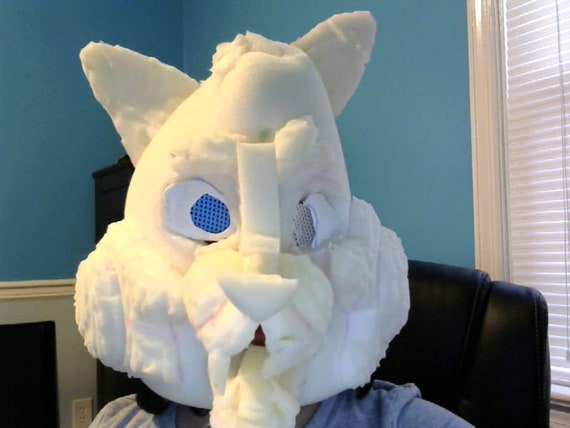
What are the coordinates of `office chair` in the screenshot? It's located at (461, 339).